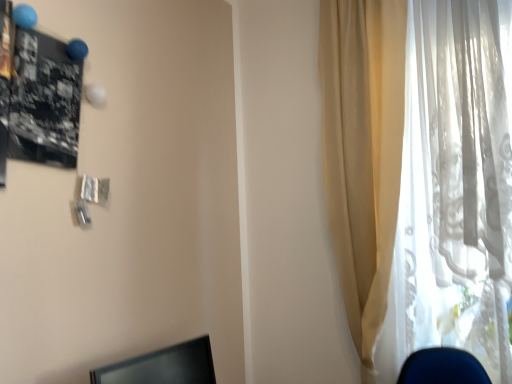
Question: Is black glossy monitor at lower left shorter than translucent white curtain at right?

Choices:
 (A) no
 (B) yes

Answer: (B)

Question: Is the position of black glossy monitor at lower left more distant than that of translucent white curtain at right?

Choices:
 (A) yes
 (B) no

Answer: (B)

Question: From the image's perspective, is black glossy monitor at lower left located beneath translucent white curtain at right?

Choices:
 (A) yes
 (B) no

Answer: (A)

Question: From the image's perspective, is black glossy monitor at lower left on translucent white curtain at right?

Choices:
 (A) yes
 (B) no

Answer: (B)

Question: Considering the relative sizes of black glossy monitor at lower left and translucent white curtain at right in the image provided, is black glossy monitor at lower left smaller than translucent white curtain at right?

Choices:
 (A) yes
 (B) no

Answer: (A)

Question: Is black glossy monitor at lower left touching translucent white curtain at right?

Choices:
 (A) no
 (B) yes

Answer: (A)

Question: Is translucent white curtain at right positioned before black glossy monitor at lower left?

Choices:
 (A) yes
 (B) no

Answer: (B)

Question: Considering the relative sizes of translucent white curtain at right and black glossy monitor at lower left in the image provided, is translucent white curtain at right wider than black glossy monitor at lower left?

Choices:
 (A) yes
 (B) no

Answer: (A)

Question: Considering the relative positions of translucent white curtain at right and black glossy monitor at lower left in the image provided, is translucent white curtain at right to the left of black glossy monitor at lower left from the viewer's perspective?

Choices:
 (A) no
 (B) yes

Answer: (A)

Question: Is black glossy monitor at lower left at the back of translucent white curtain at right?

Choices:
 (A) no
 (B) yes

Answer: (A)

Question: Can you confirm if translucent white curtain at right is positioned to the right of black glossy monitor at lower left?

Choices:
 (A) yes
 (B) no

Answer: (A)

Question: Is translucent white curtain at right bigger than black glossy monitor at lower left?

Choices:
 (A) yes
 (B) no

Answer: (A)

Question: Visually, is black glossy monitor at lower left positioned to the left or to the right of translucent white curtain at right?

Choices:
 (A) right
 (B) left

Answer: (B)